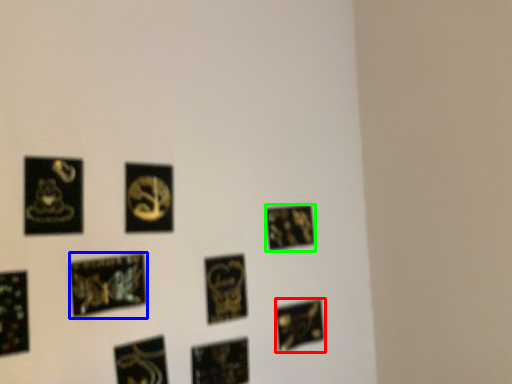
Question: Estimate the real-world distances between objects in this image. Which object is closer to picture frame (highlighted by a red box), picture frame (highlighted by a blue box) or picture frame (highlighted by a green box)?

Choices:
 (A) picture frame
 (B) picture frame

Answer: (B)